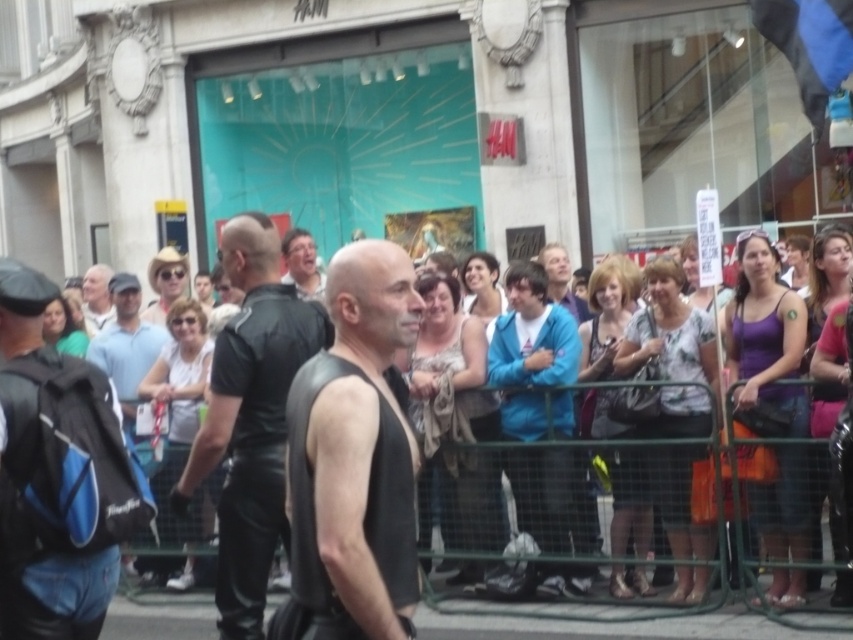
You are a photographer trying to capture both the blue leather jacket at center and the matte black shirt at center in a single frame. Which of the two items should you focus on first to ensure they both fit in the photo?

Since the blue leather jacket at center is smaller than the matte black shirt at center, you should focus on the matte black shirt at center first to ensure it fits within the frame, as it takes up more space.

You are a photographer trying to capture a clear shot of the blue backpack at left without the black leather jacket at center blocking it. How can you adjust your position to achieve this?

A: Move to the left side so that the black leather jacket at center is no longer in front of the blue backpack at left.

You are a photographer trying to capture a photo of the black leather jacket at center and the blue backpack at left. Which object should you focus on first if you want to include both in your frame without adjusting your camera angle?

The black leather jacket at center has a lesser height compared to the blue backpack at left, so you should focus on the blue backpack at left first to ensure both fit in the frame.